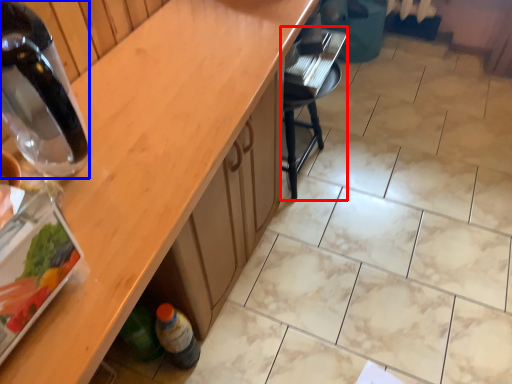
Question: Which object is further to the camera taking this photo, chair (highlighted by a red box) or bottle (highlighted by a blue box)?

Choices:
 (A) chair
 (B) bottle

Answer: (A)